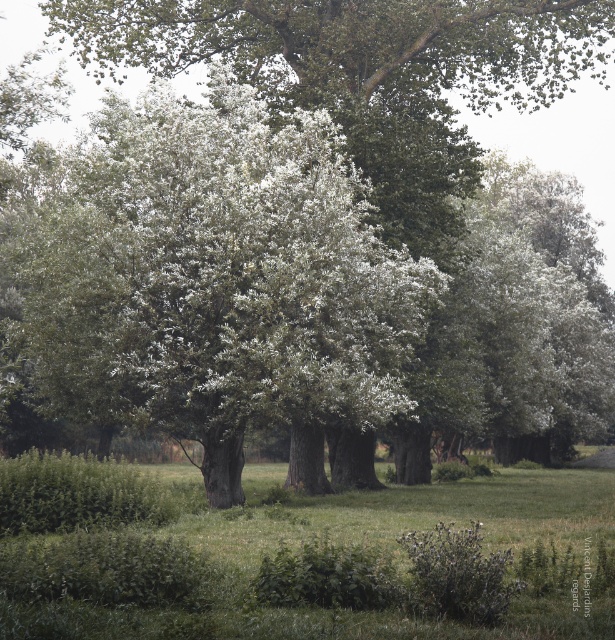
Looking at this image, does green matte tree at center appear on the left side of green leafy hedge at lower left?

Yes, green matte tree at center is to the left of green leafy hedge at lower left.

Which is in front, point (319, 381) or point (69, 486)?

Point (69, 486) is more forward.

Which is in front, point (73, 273) or point (130, 483)?

Positioned in front is point (130, 483).

Image resolution: width=615 pixels, height=640 pixels. Find the location of `green matte tree at center`. green matte tree at center is located at coordinates (204, 284).

Find the location of a particular element. green matte tree at center is located at coordinates (204, 284).

Locate an element on the screen. This screenshot has width=615, height=640. green matte tree at center is located at coordinates (204, 284).

Can you confirm if green grass at center is positioned below green leafy hedge at lower left?

Yes.

Find the location of a particular element. Image resolution: width=615 pixels, height=640 pixels. green grass at center is located at coordinates (296, 556).

Does point (613, 499) come in front of point (58, 468)?

No, (613, 499) is further to viewer.

Identify the location of green grass at center. (296, 556).